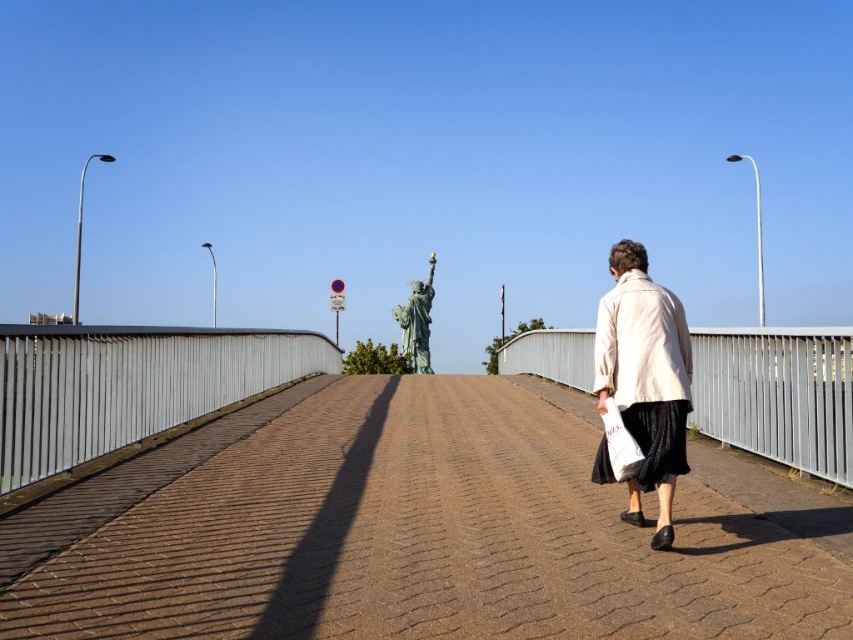
You are standing on the brown textured pavement at center and want to reach the silver metallic rail at left. Which direction should you move to get closer to the rail?

Since the brown textured pavement at center is closer to the viewer than the silver metallic rail at left, you should move towards the left to reach the rail.

Based on the photo, you are standing on the bridge and want to step onto the brown textured pavement at center. Which direction should you move relative to the silver metallic rail at left?

To step onto the brown textured pavement at center, you should move downward from the silver metallic rail at left since the pavement is located below it.

You are standing on the brown textured pavement at center and want to walk towards the light beige fabric coat at right. Which direction should you move?

You should move to the right because the light beige fabric coat at right is located to the right of the brown textured pavement at center.